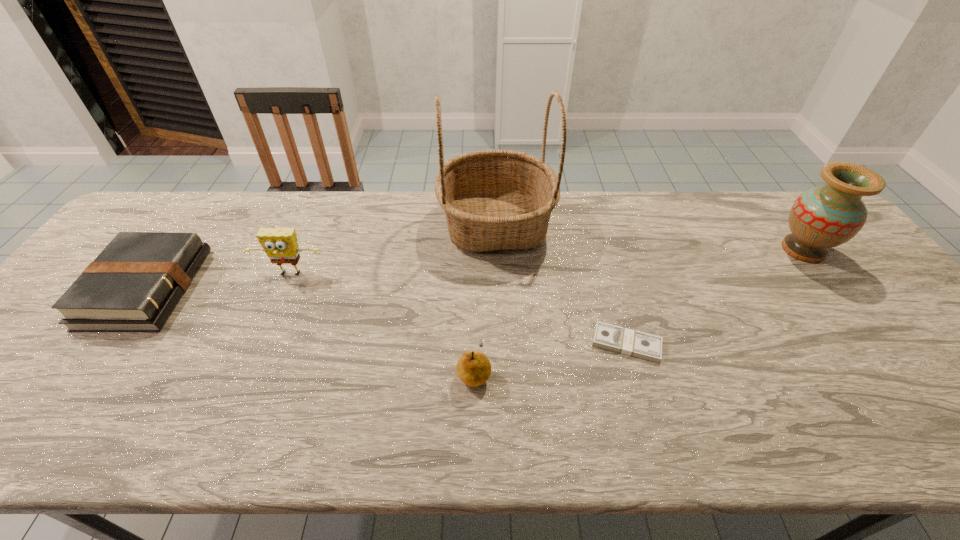
Locate an element on the screen. The width and height of the screenshot is (960, 540). blank region between the shortest object and the rightmost object is located at coordinates (715, 296).

What are the coordinates of `empty space that is in between the pear and the shortest object` in the screenshot? It's located at (550, 357).

Find the location of `free area in between the second shortest object and the pear`. free area in between the second shortest object and the pear is located at coordinates (310, 330).

Locate an element on the screen. empty space between the hardback book and the fourth tallest object is located at coordinates (310, 330).

You are a GUI agent. You are given a task and a screenshot of the screen. Output one action in this format:
    pyautogui.click(x=<x>, y=<y>)
    Task: Click on the free space between the fifth object from left to right and the fourth shortest object
    The width and height of the screenshot is (960, 540).
    Given the screenshot: What is the action you would take?
    pyautogui.click(x=459, y=309)

The height and width of the screenshot is (540, 960). Find the location of `empty space between the vase and the tallest object`. empty space between the vase and the tallest object is located at coordinates (649, 237).

Identify the location of the third closest object to the fifth tallest object. (473, 368).

Identify which object is the fourth closest to the tallest object. Please provide its 2D coordinates. Your answer should be formatted as a tuple, i.e. [(x, y)], where the tuple contains the x and y coordinates of a point satisfying the conditions above.

[(822, 217)]

At what (x,y) coordinates should I click in order to perform the action: click on blank space that satisfies the following two spatial constraints: 1. on the front side of the vase; 2. on the spine side of the fifth tallest object. Please return your answer as a coordinate pair (x, y). Image resolution: width=960 pixels, height=540 pixels. Looking at the image, I should click on (832, 288).

The image size is (960, 540). Identify the location of vacant position in the image that satisfies the following two spatial constraints: 1. on the spine side of the shortest object; 2. on the left side of the fifth tallest object. (107, 343).